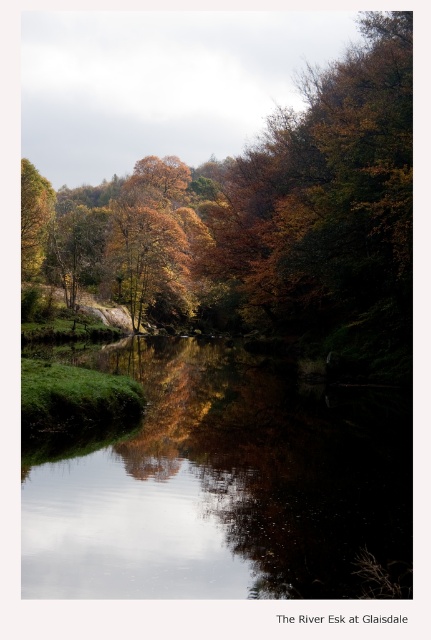
Question: Where is autumn leaves at upper center located in relation to golden leafy trees at center in the image?

Choices:
 (A) right
 (B) left

Answer: (B)

Question: Which object is positioned farthest from the smooth reflective water at center?

Choices:
 (A) autumn leaves at upper center
 (B) golden leafy trees at center

Answer: (A)

Question: Among these objects, which one is farthest from the camera?

Choices:
 (A) smooth reflective water at center
 (B) golden leafy trees at center

Answer: (B)

Question: Can you confirm if smooth reflective water at center is positioned below autumn leaves at upper center?

Choices:
 (A) no
 (B) yes

Answer: (B)

Question: Which of the following is the farthest from the observer?

Choices:
 (A) smooth reflective water at center
 (B) autumn leaves at upper center
 (C) golden leafy trees at center

Answer: (B)

Question: Does smooth reflective water at center come in front of golden leafy trees at center?

Choices:
 (A) no
 (B) yes

Answer: (B)